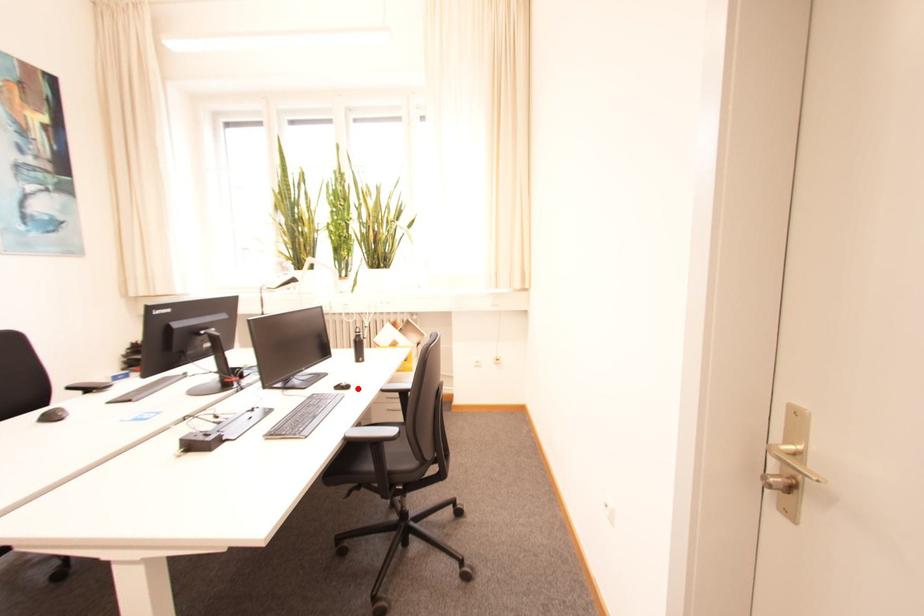
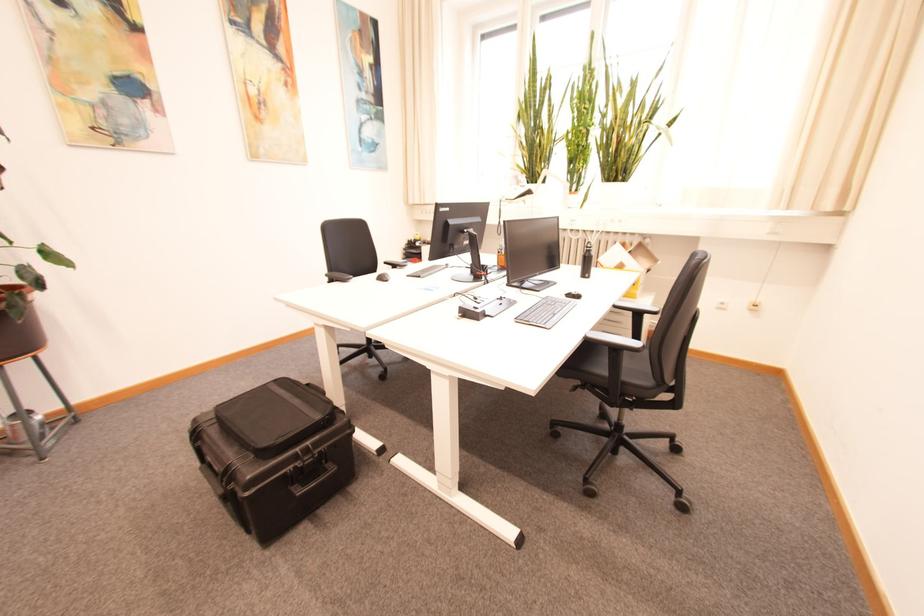
Question: I am providing you with two images of the same scene from different viewpoints. A red point is marked on the first image. Can you still see the location of the red point in image 2?

Choices:
 (A) Yes
 (B) No

Answer: (A)